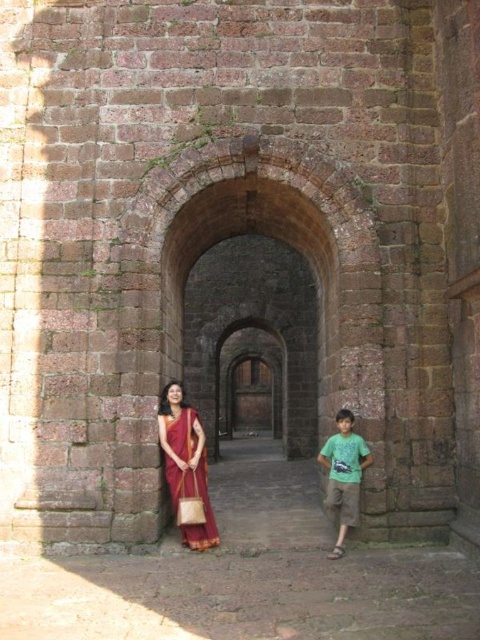
Question: Which object appears farthest from the camera in this image?

Choices:
 (A) maroon silk saree at center
 (B) green cotton shirt at lower right

Answer: (A)

Question: Which point is closer to the camera?

Choices:
 (A) green cotton shirt at lower right
 (B) maroon silk saree at center

Answer: (A)

Question: Does maroon silk saree at center lie behind green cotton shirt at lower right?

Choices:
 (A) yes
 (B) no

Answer: (A)

Question: Is maroon silk saree at center above green cotton shirt at lower right?

Choices:
 (A) no
 (B) yes

Answer: (B)

Question: Does maroon silk saree at center have a larger size compared to green cotton shirt at lower right?

Choices:
 (A) no
 (B) yes

Answer: (A)

Question: Which of the following is the closest to the observer?

Choices:
 (A) (348, 432)
 (B) (199, 442)

Answer: (A)